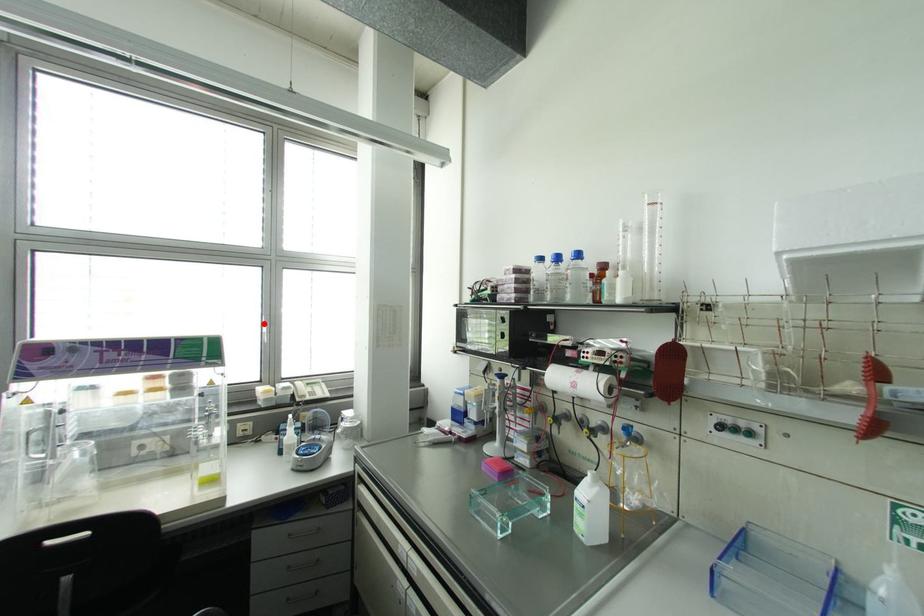
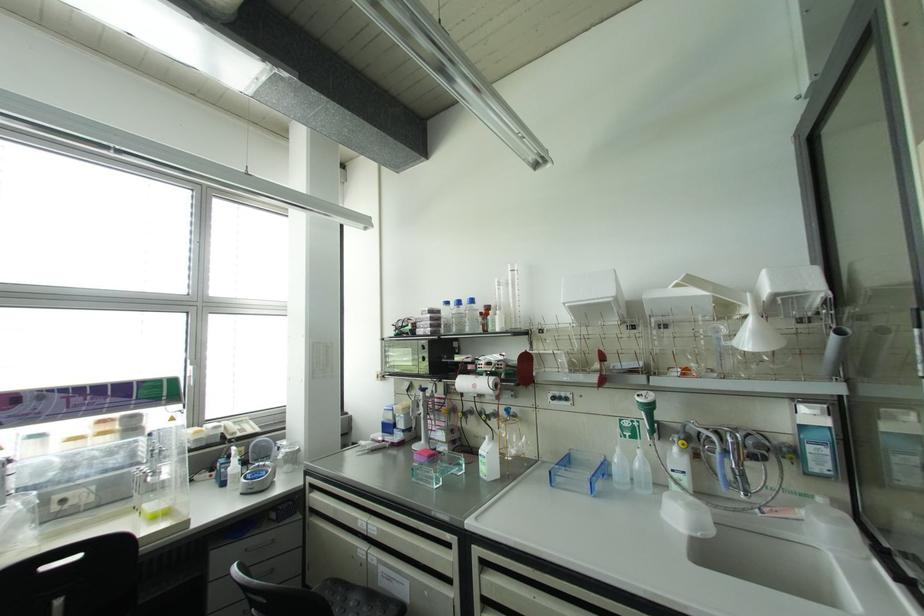
Find the pixel in the second image that matches the highlighted location in the first image.

(189, 368)